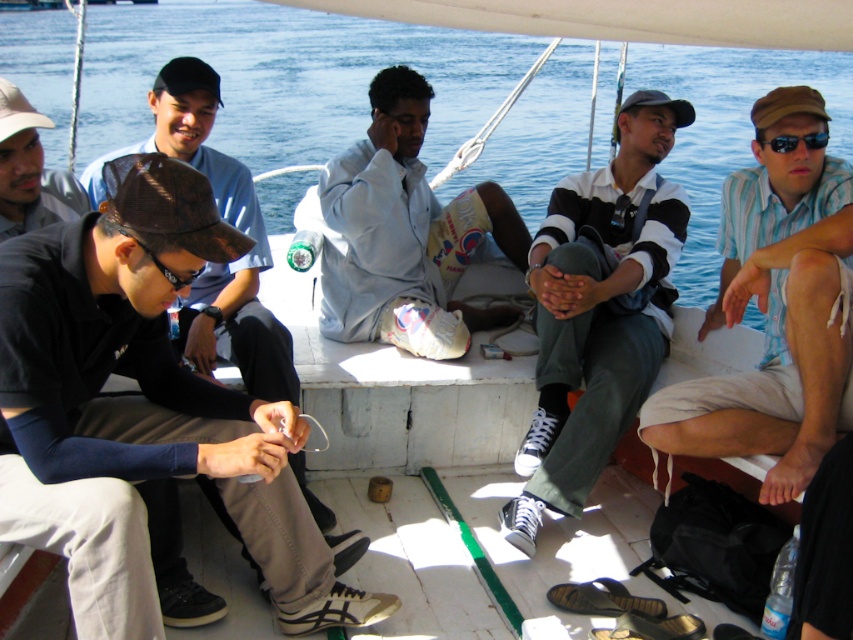
What are the coordinates of the striped cotton shirt at right?

The striped cotton shirt at right is located at point [776,305].